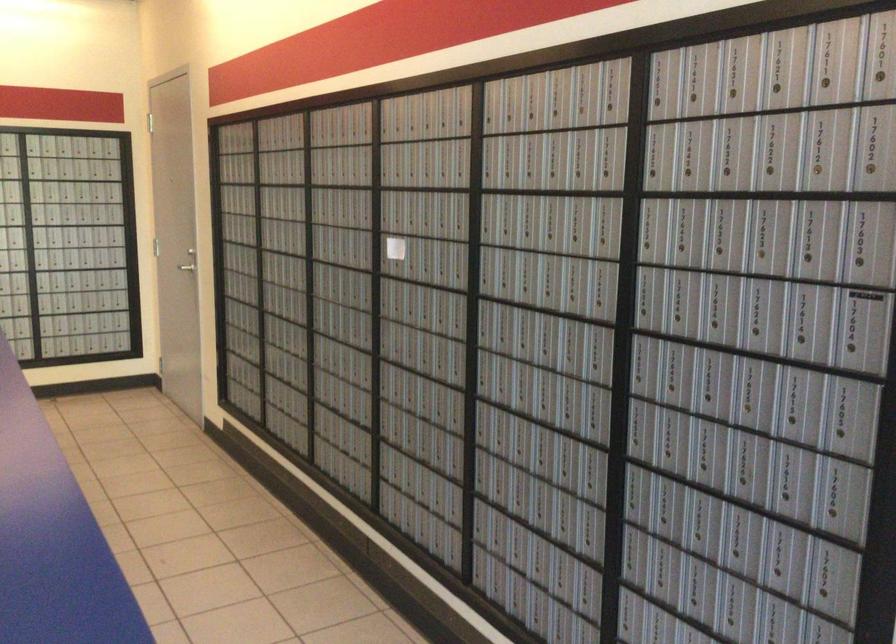
Locate an element on the screen. silver  door is located at coordinates (176, 241).